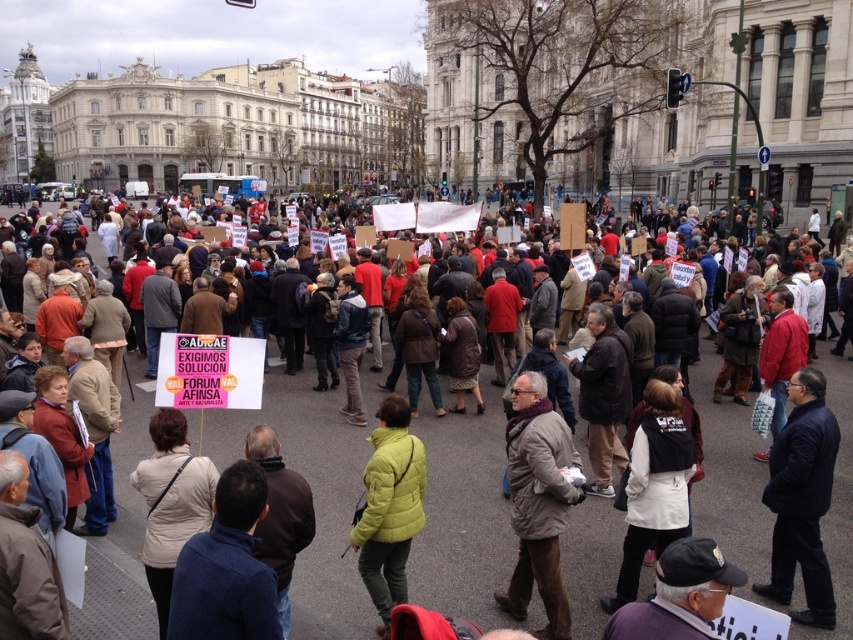
Question: Can you confirm if multicolored fabric crowd at center is positioned to the right of matte yellow jacket at center?

Choices:
 (A) yes
 (B) no

Answer: (A)

Question: Among these points, which one is farthest from the camera?

Choices:
 (A) (376, 428)
 (B) (505, 582)

Answer: (A)

Question: Which point is farther to the camera?

Choices:
 (A) multicolored fabric crowd at center
 (B) matte yellow jacket at center

Answer: (B)

Question: Which point is closer to the camera?

Choices:
 (A) matte yellow jacket at center
 (B) multicolored fabric crowd at center

Answer: (B)

Question: Is multicolored fabric crowd at center wider than matte yellow jacket at center?

Choices:
 (A) yes
 (B) no

Answer: (A)

Question: Does multicolored fabric crowd at center have a larger size compared to matte yellow jacket at center?

Choices:
 (A) no
 (B) yes

Answer: (B)